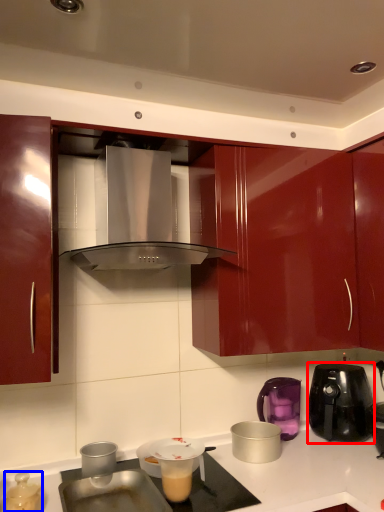
Question: Which point is further to the camera, kitchen appliance (highlighted by a red box) or kitchen appliance (highlighted by a blue box)?

Choices:
 (A) kitchen appliance
 (B) kitchen appliance

Answer: (A)